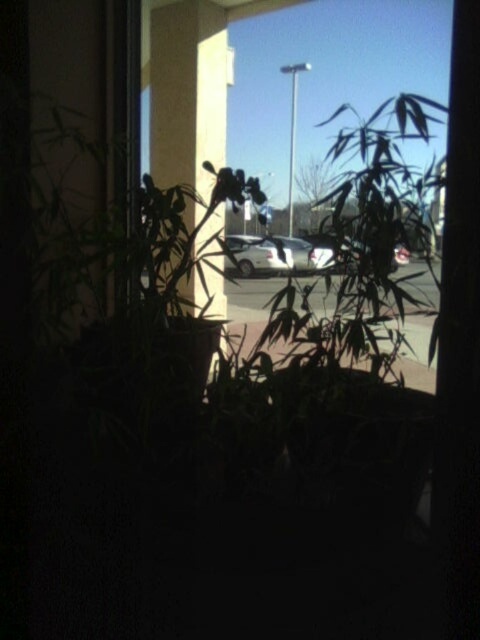
Which is more to the right, satin silver car at center or white matte car at center?

Positioned to the right is white matte car at center.

Does satin silver car at center have a smaller size compared to white matte car at center?

No, satin silver car at center is not smaller than white matte car at center.

Between point (228, 243) and point (402, 256), which one is positioned behind?

The point (228, 243) is more distant.

The height and width of the screenshot is (640, 480). What are the coordinates of `satin silver car at center` in the screenshot? It's located at (273, 256).